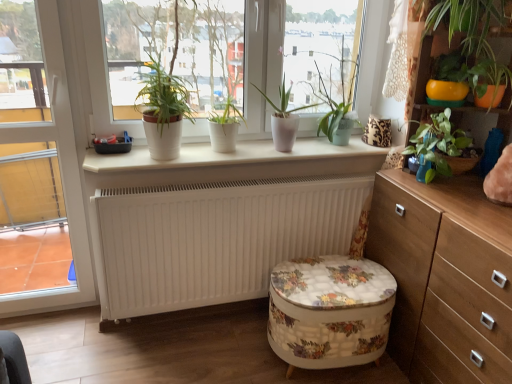
The image size is (512, 384). I want to click on vacant space in between green glossy plant at upper right, which is the fourth houseplant in left-to-right order, and yellow plastic bowl at upper right, so click(433, 181).